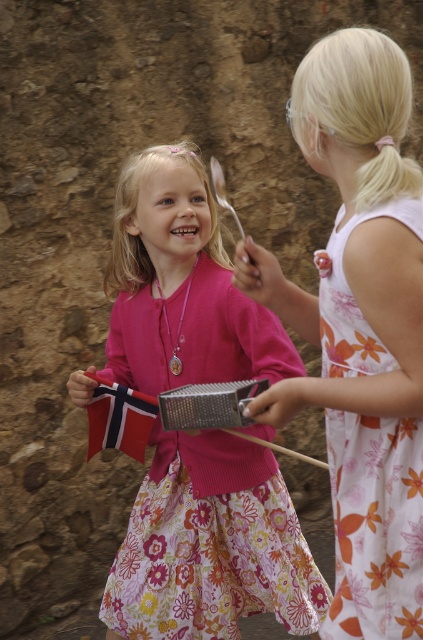
Question: Which point appears farthest from the camera in this image?

Choices:
 (A) (386, 512)
 (B) (154, 380)

Answer: (B)

Question: Is the position of pink matte sweater at center less distant than that of floral dress at center?

Choices:
 (A) yes
 (B) no

Answer: (B)

Question: From the image, what is the correct spatial relationship of pink matte sweater at center in relation to floral dress at center?

Choices:
 (A) right
 (B) left

Answer: (B)

Question: Which object is the closest to the floral dress at center?

Choices:
 (A) pink matte sweater at center
 (B) floral cotton dress at right

Answer: (B)

Question: Which of the following is the farthest from the observer?

Choices:
 (A) (386, 618)
 (B) (354, 634)
 (C) (153, 156)

Answer: (C)

Question: Considering the relative positions of pink matte sweater at center and floral dress at center in the image provided, where is pink matte sweater at center located with respect to floral dress at center?

Choices:
 (A) left
 (B) right

Answer: (A)